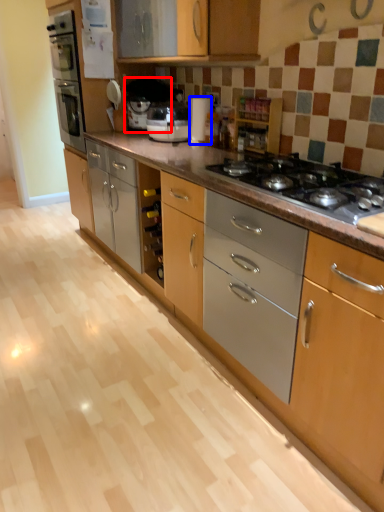
Question: Among these objects, which one is farthest to the camera, coffee machine (highlighted by a red box) or appliance (highlighted by a blue box)?

Choices:
 (A) coffee machine
 (B) appliance

Answer: (A)